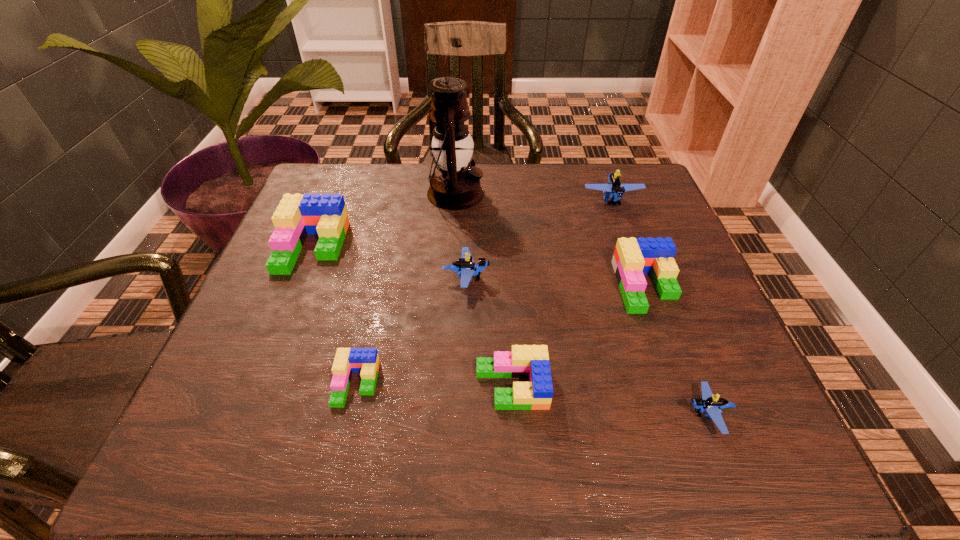
Where is `free area in between the lantern and the sixth Lego from right to left`? The width and height of the screenshot is (960, 540). free area in between the lantern and the sixth Lego from right to left is located at coordinates (406, 288).

Where is `free spot between the leftmost Lego and the third biggest green Lego`? The image size is (960, 540). free spot between the leftmost Lego and the third biggest green Lego is located at coordinates (412, 316).

Identify the location of vacant area that lies between the second green Lego from right to left and the farthest Lego. The height and width of the screenshot is (540, 960). (562, 293).

Identify the location of unoccupied area between the second nearest blue Lego and the biggest green Lego. The image size is (960, 540). (389, 262).

You are a GUI agent. You are given a task and a screenshot of the screen. Output one action in this format:
    pyautogui.click(x=<x>, y=<y>)
    Task: Click on the object that is the third closest to the leftmost green Lego
    This screenshot has height=540, width=960.
    Given the screenshot: What is the action you would take?
    pyautogui.click(x=465, y=267)

Identify which object is located as the fifth nearest to the biggest blue Lego. Please provide its 2D coordinates. Your answer should be formatted as a tuple, i.e. [(x, y)], where the tuple contains the x and y coordinates of a point satisfying the conditions above.

[(712, 404)]

Identify which Lego is the fourth closest to the nearest blue Lego. Please provide its 2D coordinates. Your answer should be formatted as a tuple, i.e. [(x, y)], where the tuple contains the x and y coordinates of a point satisfying the conditions above.

[(614, 189)]

Where is `Lego that can be found as the fifth closest to the second nearest blue Lego`? Lego that can be found as the fifth closest to the second nearest blue Lego is located at coordinates (614, 189).

At what (x,y) coordinates should I click in order to perform the action: click on blue Lego that is the third closest to the brown lantern. Please return your answer as a coordinate pair (x, y). Image resolution: width=960 pixels, height=540 pixels. Looking at the image, I should click on (712, 404).

You are a GUI agent. You are given a task and a screenshot of the screen. Output one action in this format:
    pyautogui.click(x=<x>, y=<y>)
    Task: Click on the blue Lego that is the closest to the farthest blue Lego
    The width and height of the screenshot is (960, 540).
    Given the screenshot: What is the action you would take?
    pyautogui.click(x=465, y=267)